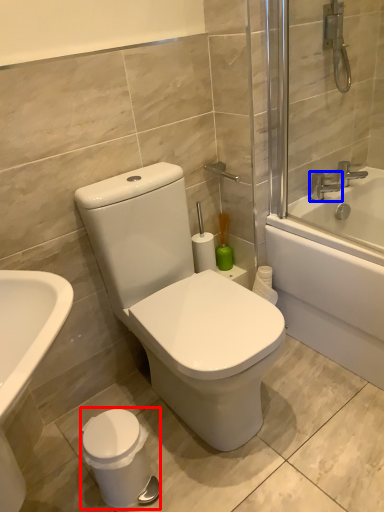
Question: Which object is closer to the camera taking this photo, porcelain (highlighted by a red box) or tap (highlighted by a blue box)?

Choices:
 (A) porcelain
 (B) tap

Answer: (A)